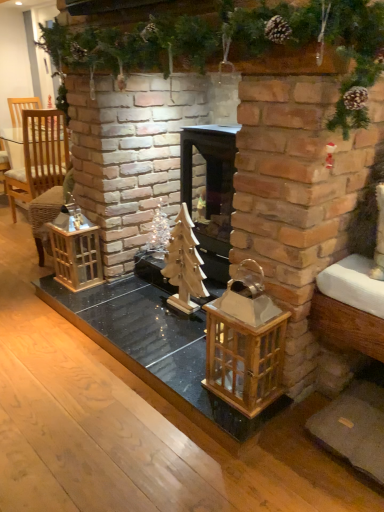
Question: Is wooden lantern at left, arranged as the 1th cage when viewed from the left, smaller than woven wicker armchair at left?

Choices:
 (A) no
 (B) yes

Answer: (B)

Question: Is the position of wooden lantern at left, marked as the 2th cage in a right-to-left arrangement, more distant than that of woven wicker armchair at left?

Choices:
 (A) no
 (B) yes

Answer: (A)

Question: From the image's perspective, is wooden lantern at left, marked as the 2th cage in a right-to-left arrangement, under woven wicker armchair at left?

Choices:
 (A) no
 (B) yes

Answer: (B)

Question: Considering the relative positions of wooden lantern at left, arranged as the 1th cage when viewed from the left, and woven wicker armchair at left in the image provided, is wooden lantern at left, arranged as the 1th cage when viewed from the left, to the right of woven wicker armchair at left from the viewer's perspective?

Choices:
 (A) no
 (B) yes

Answer: (B)

Question: From a real-world perspective, is wooden lantern at left, marked as the 2th cage in a right-to-left arrangement, located beneath woven wicker armchair at left?

Choices:
 (A) no
 (B) yes

Answer: (B)

Question: Based on their sizes in the image, would you say woven wicker armchair at left is bigger or smaller than wooden lantern at center, which ranks as the 1th cage in right-to-left order?

Choices:
 (A) big
 (B) small

Answer: (A)

Question: Do you think woven wicker armchair at left is within wooden lantern at center, which ranks as the first cage in front-to-back order, or outside of it?

Choices:
 (A) inside
 (B) outside

Answer: (B)

Question: From the image's perspective, is woven wicker armchair at left located above or below wooden lantern at center, which ranks as the 1th cage in right-to-left order?

Choices:
 (A) above
 (B) below

Answer: (A)

Question: From a real-world perspective, is woven wicker armchair at left above or below wooden lantern at center, which ranks as the first cage in front-to-back order?

Choices:
 (A) above
 (B) below

Answer: (A)

Question: Considering their positions, is wooden lantern at center, the second cage viewed from the left, located in front of or behind black wood fireplace at center?

Choices:
 (A) front
 (B) behind

Answer: (A)

Question: From the image's perspective, is wooden lantern at center, the second cage viewed from the left, above or below black wood fireplace at center?

Choices:
 (A) below
 (B) above

Answer: (A)

Question: Is wooden lantern at center, the second cage viewed from the left, bigger or smaller than black wood fireplace at center?

Choices:
 (A) small
 (B) big

Answer: (A)

Question: Considering the positions of point (253, 376) and point (188, 137), is point (253, 376) closer or farther from the camera than point (188, 137)?

Choices:
 (A) closer
 (B) farther

Answer: (A)

Question: From a real-world perspective, is wooden christmas tree at center physically located above or below black wood fireplace at center?

Choices:
 (A) below
 (B) above

Answer: (A)

Question: Is wooden christmas tree at center to the left or to the right of black wood fireplace at center in the image?

Choices:
 (A) right
 (B) left

Answer: (B)